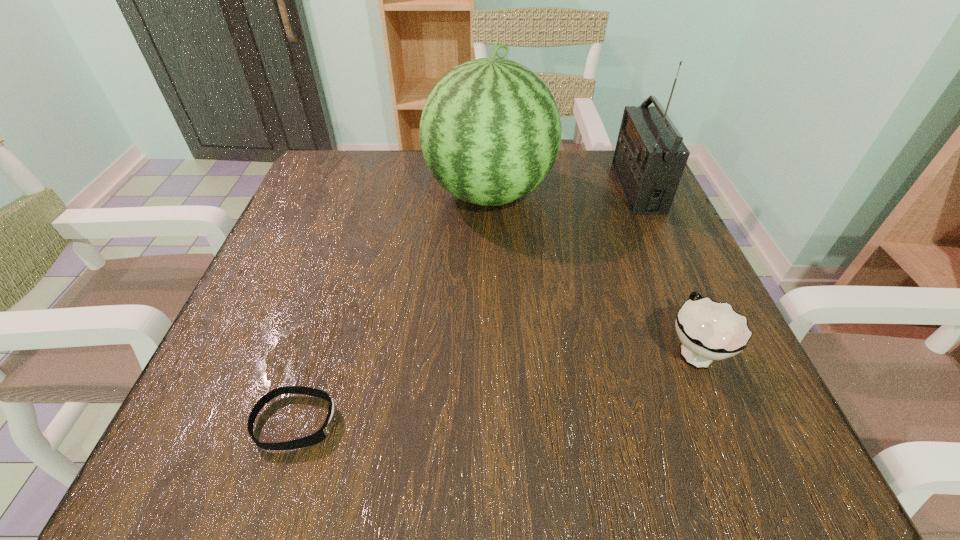
In order to click on the third object from right to left in this screenshot , I will do `click(490, 131)`.

Where is `radio receiver`? The width and height of the screenshot is (960, 540). radio receiver is located at coordinates (649, 159).

Locate an element on the screen. This screenshot has height=540, width=960. the third tallest object is located at coordinates (708, 330).

You are a GUI agent. You are given a task and a screenshot of the screen. Output one action in this format:
    pyautogui.click(x=<x>, y=<y>)
    Task: Click on the second nearest object
    
    Given the screenshot: What is the action you would take?
    pyautogui.click(x=708, y=330)

I want to click on the nearest object, so click(322, 433).

This screenshot has height=540, width=960. Find the location of `the leftmost object`. the leftmost object is located at coordinates (322, 433).

At what (x,y) coordinates should I click in order to perform the action: click on free region located on the right of the watermelon. Please return your answer as a coordinate pair (x, y). The width and height of the screenshot is (960, 540). Looking at the image, I should click on (638, 194).

What are the coordinates of `free space located 0.150m on the front panel of the radio receiver` in the screenshot? It's located at (553, 187).

Image resolution: width=960 pixels, height=540 pixels. What are the coordinates of `vacant space positioned on the front panel of the radio receiver` in the screenshot? It's located at (597, 187).

Image resolution: width=960 pixels, height=540 pixels. What are the coordinates of `vacant space situated on the front panel of the radio receiver` in the screenshot? It's located at (588, 187).